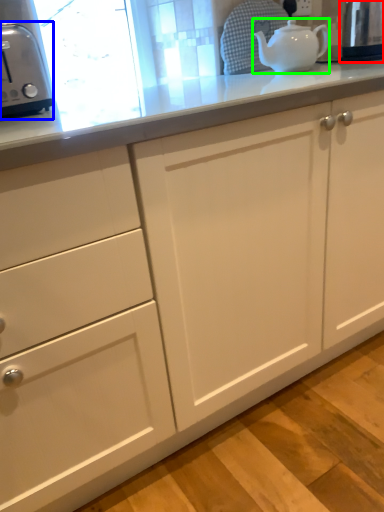
Question: Estimate the real-world distances between objects in this image. Which object is closer to appliance (highlighted by a red box), toaster (highlighted by a blue box) or teapot (highlighted by a green box)?

Choices:
 (A) toaster
 (B) teapot

Answer: (B)